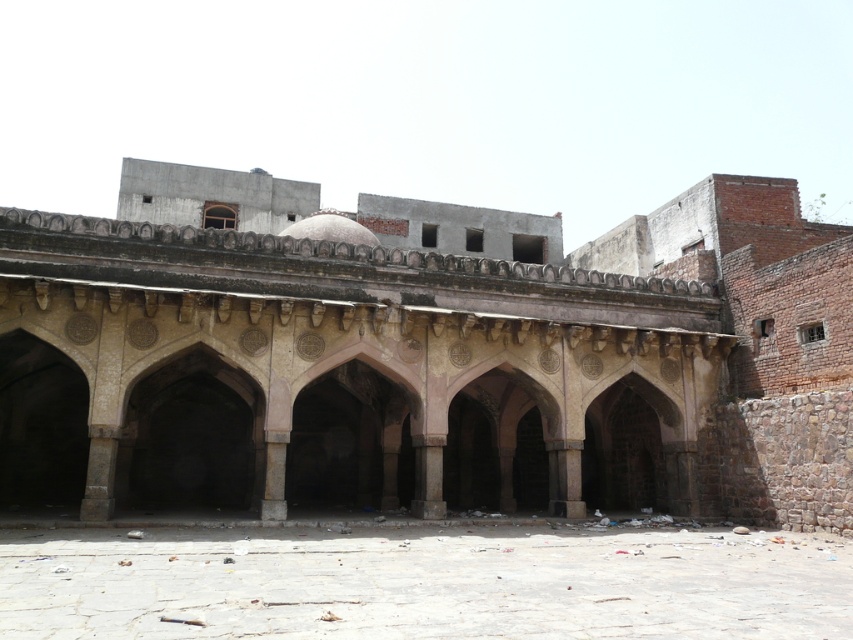
Can you confirm if stone archway at center is shorter than stone paved courtyard at center?

Incorrect, stone archway at center's height does not fall short of stone paved courtyard at center's.

Can you confirm if stone archway at center is positioned to the right of stone paved courtyard at center?

Incorrect, stone archway at center is not on the right side of stone paved courtyard at center.

Which is behind, point (492, 497) or point (843, 554)?

Positioned behind is point (492, 497).

I want to click on stone archway at center, so click(x=425, y=355).